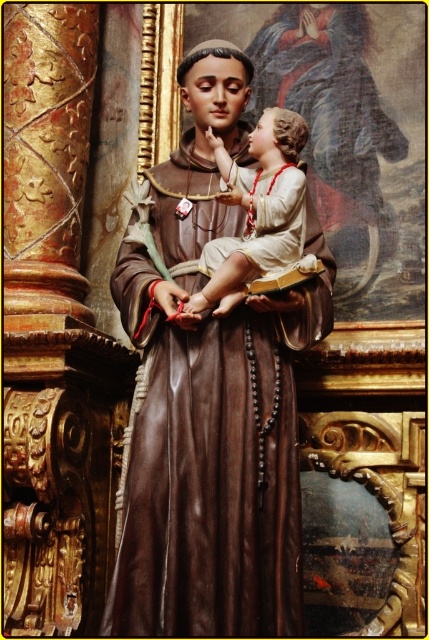
You are standing in front of a statue of Saint Anthony of Padua. The statue is made of matte brown material and is positioned at the center of the scene. If you want to take a closer look without moving, which direction should you move to get nearer to the matte brown statue at center?

You should move forward towards the matte brown statue at center since it is positioned at the center of the scene and you are currently 72.51 feet away from it.

You are an art conservator examining the statue of Saint Anthony. You notice the matte brown statue at center and the smooth beige fabric at center. Which object is positioned higher in the image?

The matte brown statue at center is positioned higher than the smooth beige fabric at center.